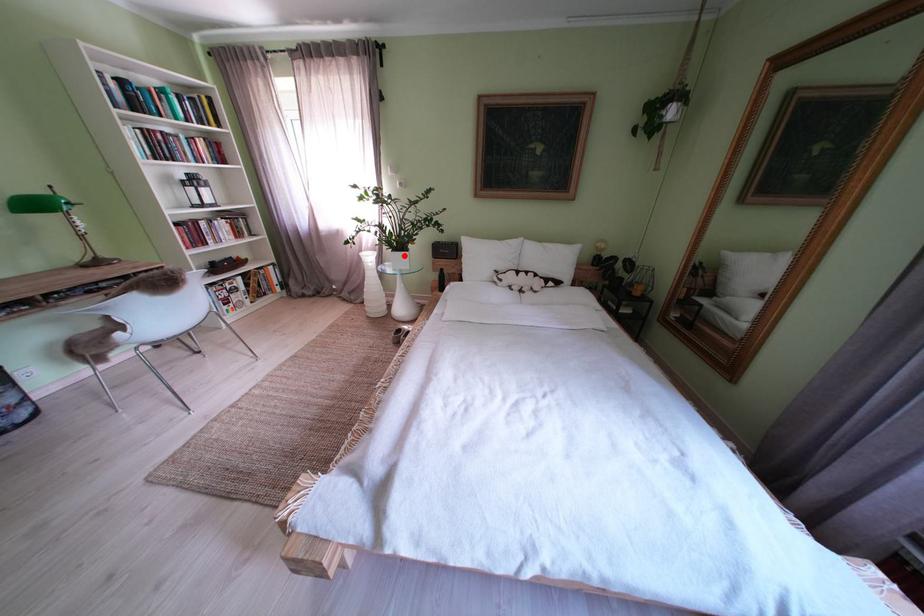
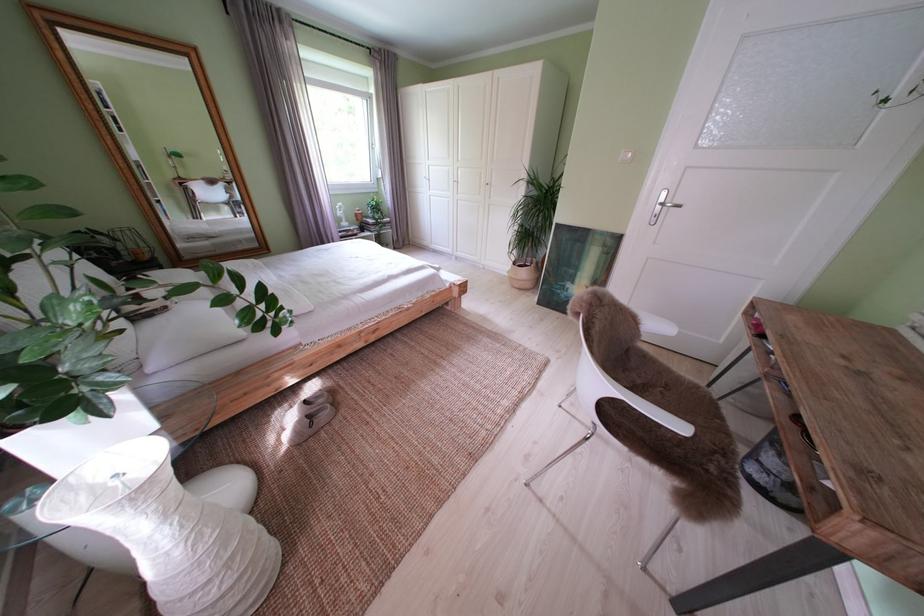
In the second image, find the point that corresponds to the highlighted location in the first image.

(112, 395)